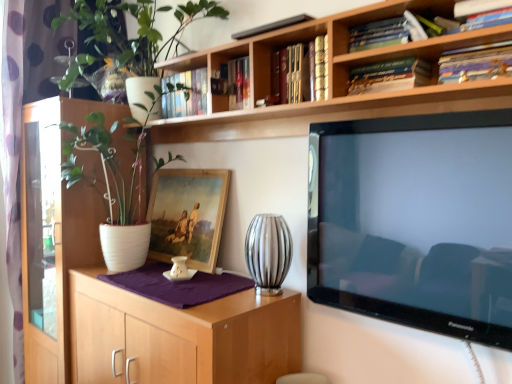
Image resolution: width=512 pixels, height=384 pixels. In order to click on empty space that is ontop of wooden cabinet at center (from a real-world perspective) in this screenshot , I will do `click(168, 286)`.